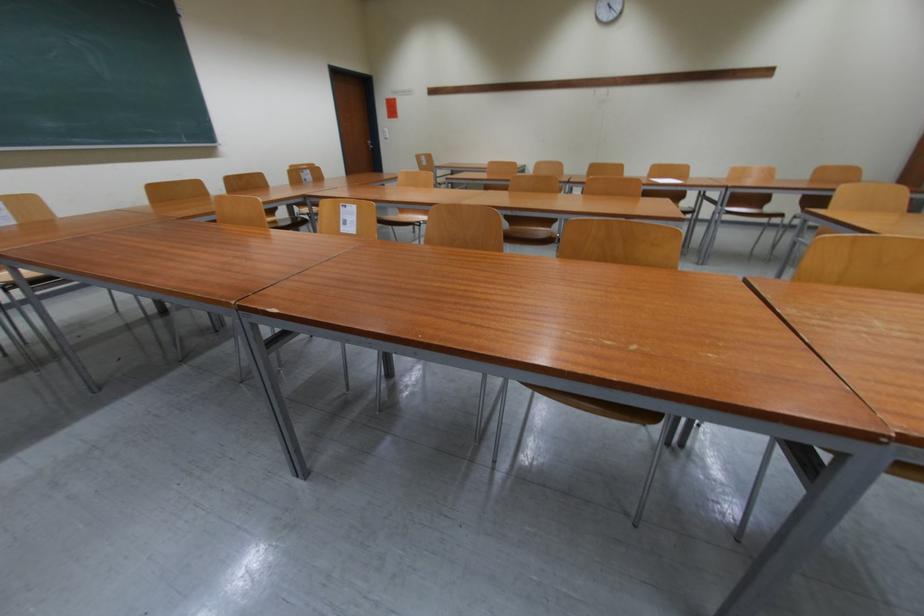
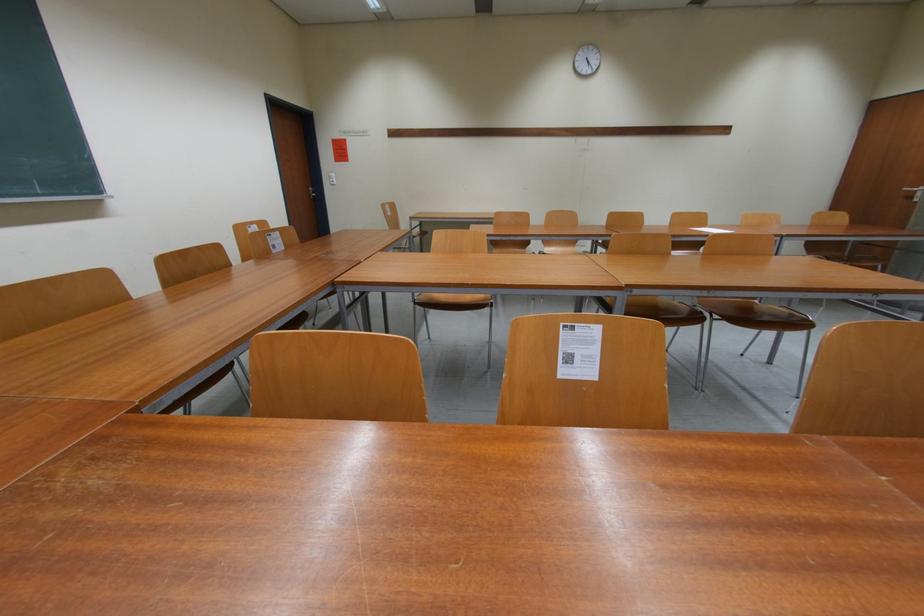
The images are taken continuously from a first-person perspective. In which direction are you moving?

The cameraman moved toward left, forward.